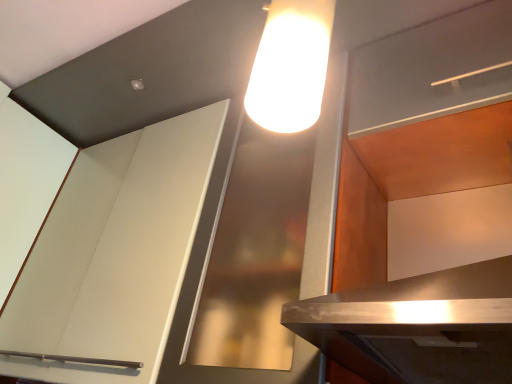
Question: Is white matte cabinet at upper left, arranged as the second cabinetry when viewed from the right, turned away from matte wood shelf at upper right?

Choices:
 (A) no
 (B) yes

Answer: (A)

Question: From the image's perspective, is white matte cabinet at upper left, marked as the 1th cabinetry in a left-to-right arrangement, on matte wood shelf at upper right?

Choices:
 (A) no
 (B) yes

Answer: (A)

Question: Is white matte cabinet at upper left, marked as the 1th cabinetry in a left-to-right arrangement, bigger than matte wood shelf at upper right?

Choices:
 (A) yes
 (B) no

Answer: (A)

Question: Does white matte cabinet at upper left, marked as the 1th cabinetry in a left-to-right arrangement, have a greater height compared to matte wood shelf at upper right?

Choices:
 (A) no
 (B) yes

Answer: (B)

Question: Does white matte cabinet at upper left, marked as the 1th cabinetry in a left-to-right arrangement, appear on the left side of matte wood shelf at upper right?

Choices:
 (A) yes
 (B) no

Answer: (A)

Question: From the image's perspective, is matte white cabinet at upper right, which ranks as the first cabinetry in right-to-left order, above or below white matte cabinet at upper left, arranged as the second cabinetry when viewed from the right?

Choices:
 (A) above
 (B) below

Answer: (A)

Question: Is matte white cabinet at upper right, which ranks as the first cabinetry in right-to-left order, bigger or smaller than white matte cabinet at upper left, arranged as the second cabinetry when viewed from the right?

Choices:
 (A) big
 (B) small

Answer: (B)

Question: Looking at their shapes, would you say matte white cabinet at upper right, which is counted as the second cabinetry, starting from the left, is wider or thinner than white matte cabinet at upper left, arranged as the second cabinetry when viewed from the right?

Choices:
 (A) thin
 (B) wide

Answer: (B)

Question: Relative to white matte cabinet at upper left, arranged as the second cabinetry when viewed from the right, is matte white cabinet at upper right, which is counted as the second cabinetry, starting from the left, in front or behind?

Choices:
 (A) behind
 (B) front

Answer: (B)

Question: Does point click(362, 69) appear closer or farther from the camera than point click(390, 190)?

Choices:
 (A) farther
 (B) closer

Answer: (B)

Question: Looking at their shapes, would you say matte wood shelf at upper right is wider or thinner than matte white cabinet at upper right, which is counted as the second cabinetry, starting from the left?

Choices:
 (A) thin
 (B) wide

Answer: (A)

Question: From the image's perspective, relative to matte white cabinet at upper right, which ranks as the first cabinetry in right-to-left order, is matte wood shelf at upper right above or below?

Choices:
 (A) above
 (B) below

Answer: (A)

Question: From their relative heights in the image, would you say matte wood shelf at upper right is taller or shorter than matte white cabinet at upper right, which is counted as the second cabinetry, starting from the left?

Choices:
 (A) tall
 (B) short

Answer: (B)

Question: Would you say matte white cabinet at upper right, which is counted as the second cabinetry, starting from the left, is inside or outside matte wood shelf at upper right?

Choices:
 (A) outside
 (B) inside

Answer: (A)

Question: Is matte white cabinet at upper right, which is counted as the second cabinetry, starting from the left, bigger or smaller than matte wood shelf at upper right?

Choices:
 (A) small
 (B) big

Answer: (B)